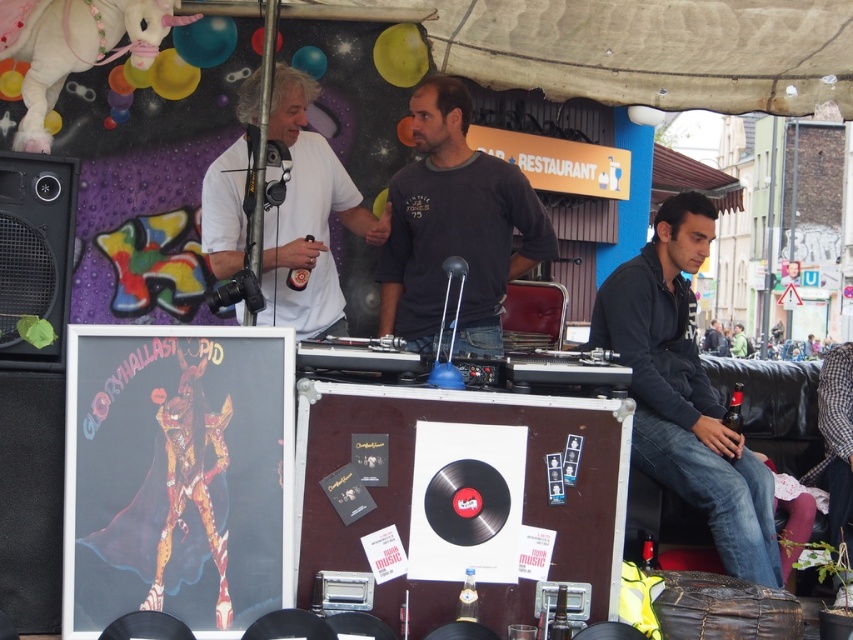
Question: Is black softshell jacket at lower right thinner than dark gray long-sleeved shirt at center?

Choices:
 (A) yes
 (B) no

Answer: (A)

Question: Among these objects, which one is nearest to the camera?

Choices:
 (A) dark gray long-sleeved shirt at center
 (B) black matte speaker at left

Answer: (B)

Question: Can you confirm if dark gray long-sleeved shirt at center is thinner than white matte t-shirt at upper left?

Choices:
 (A) yes
 (B) no

Answer: (A)

Question: Does dark gray long-sleeved shirt at center lie behind black matte speaker at left?

Choices:
 (A) yes
 (B) no

Answer: (A)

Question: Which point is closer to the camera taking this photo?

Choices:
 (A) (271, 134)
 (B) (480, 256)
 (C) (57, 356)

Answer: (C)

Question: Estimate the real-world distances between objects in this image. Which object is farther from the black matte speaker at left?

Choices:
 (A) dark gray long-sleeved shirt at center
 (B) white matte t-shirt at upper left
 (C) black softshell jacket at lower right

Answer: (A)